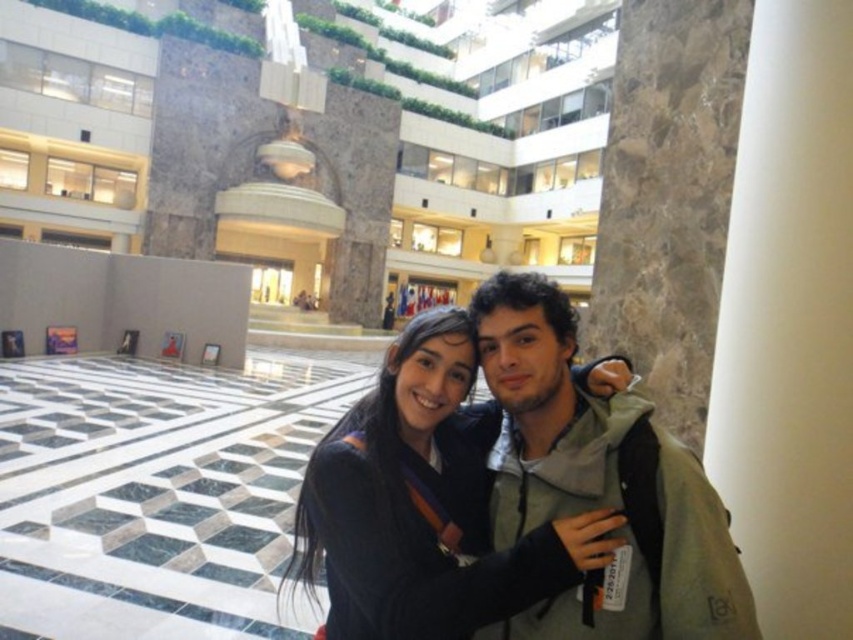
Is gray fabric jacket at center to the left of dark gray sweater at center from the viewer's perspective?

No, gray fabric jacket at center is not to the left of dark gray sweater at center.

Can you confirm if gray fabric jacket at center is bigger than dark gray sweater at center?

Yes.

Who is more forward, [699,602] or [337,579]?

Point [699,602] is in front.

This screenshot has width=853, height=640. Find the location of `gray fabric jacket at center`. gray fabric jacket at center is located at coordinates (599, 484).